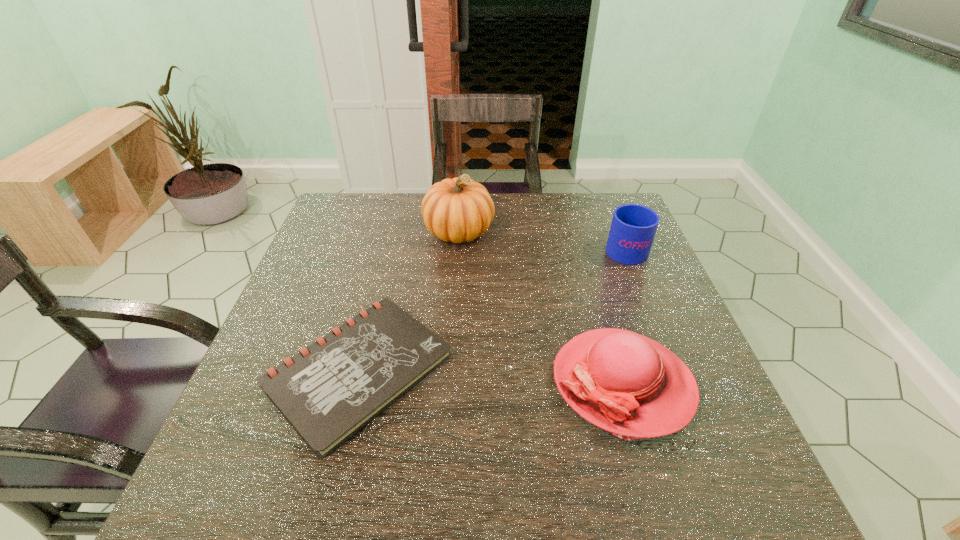
The image size is (960, 540). I want to click on vacant area that lies between the hat and the pumpkin, so click(x=540, y=307).

Locate an element on the screen. empty location between the hat and the tallest object is located at coordinates (540, 307).

The width and height of the screenshot is (960, 540). What are the coordinates of `vacant region between the hat and the mug` in the screenshot? It's located at (624, 315).

This screenshot has width=960, height=540. Identify the location of unoccupied position between the hat and the shortest object. (491, 376).

Where is `vacant point located between the tallest object and the mug`? vacant point located between the tallest object and the mug is located at coordinates (541, 239).

Identify which object is located as the third nearest to the shortest object. Please provide its 2D coordinates. Your answer should be formatted as a tuple, i.e. [(x, y)], where the tuple contains the x and y coordinates of a point satisfying the conditions above.

[(633, 228)]

In order to click on object that is the closest to the mug in this screenshot , I will do `click(622, 382)`.

Where is `vacant space that satisfies the following two spatial constraints: 1. on the back side of the pumpkin; 2. on the left side of the shortest object`? vacant space that satisfies the following two spatial constraints: 1. on the back side of the pumpkin; 2. on the left side of the shortest object is located at coordinates tap(395, 231).